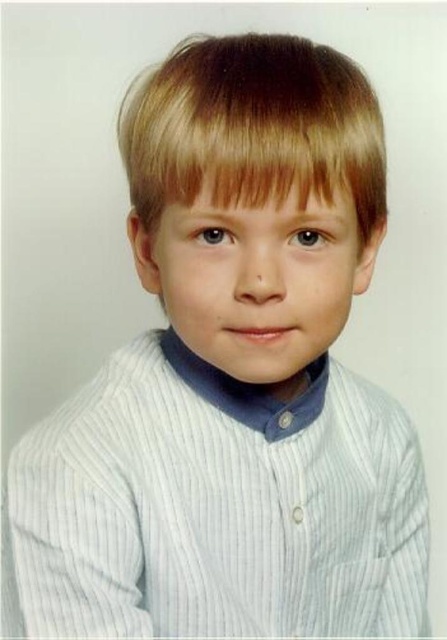
Can you confirm if blonde silky hair at upper center is wider than smooth skin face at center?

Yes.

Can you confirm if blonde silky hair at upper center is smaller than smooth skin face at center?

Actually, blonde silky hair at upper center might be larger than smooth skin face at center.

You are a GUI agent. You are given a task and a screenshot of the screen. Output one action in this format:
    pyautogui.click(x=<x>, y=<y>)
    Task: Click on the blonde silky hair at upper center
    The image size is (447, 640).
    Given the screenshot: What is the action you would take?
    pyautogui.click(x=253, y=129)